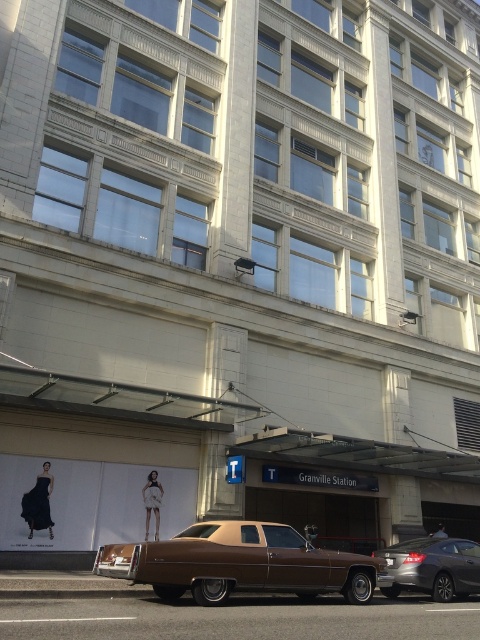
Which is below, brown matte sedan at center or silver metallic sedan at lower right?

silver metallic sedan at lower right is lower down.

Who is taller, brown matte sedan at center or silver metallic sedan at lower right?

Standing taller between the two is brown matte sedan at center.

Is point (216, 582) positioned in front of point (443, 545)?

That is True.

Where is `brown matte sedan at center`? Image resolution: width=480 pixels, height=640 pixels. brown matte sedan at center is located at coordinates (240, 563).